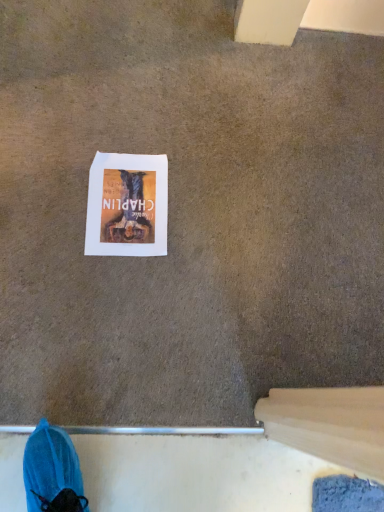
Question: Should I look upward or downward to see white paper at center?

Choices:
 (A) up
 (B) down

Answer: (A)